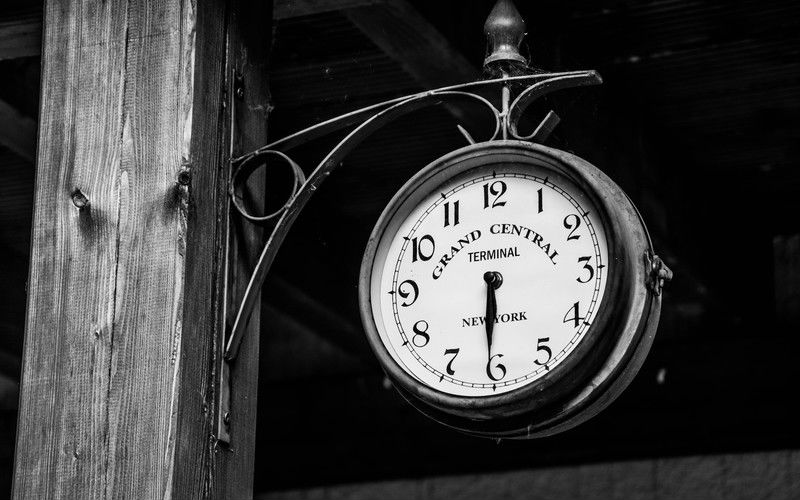
Locate an element on the screen. screw that holds the clock hands in place is located at coordinates [x=490, y=278].